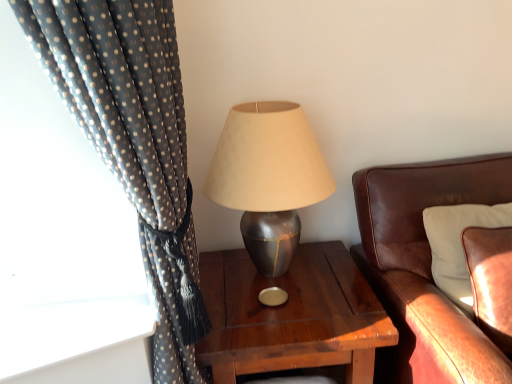
Find the location of a particular element. This screenshot has width=512, height=384. vacant space in metallic gray lamp at center (from a real-world perspective) is located at coordinates (280, 282).